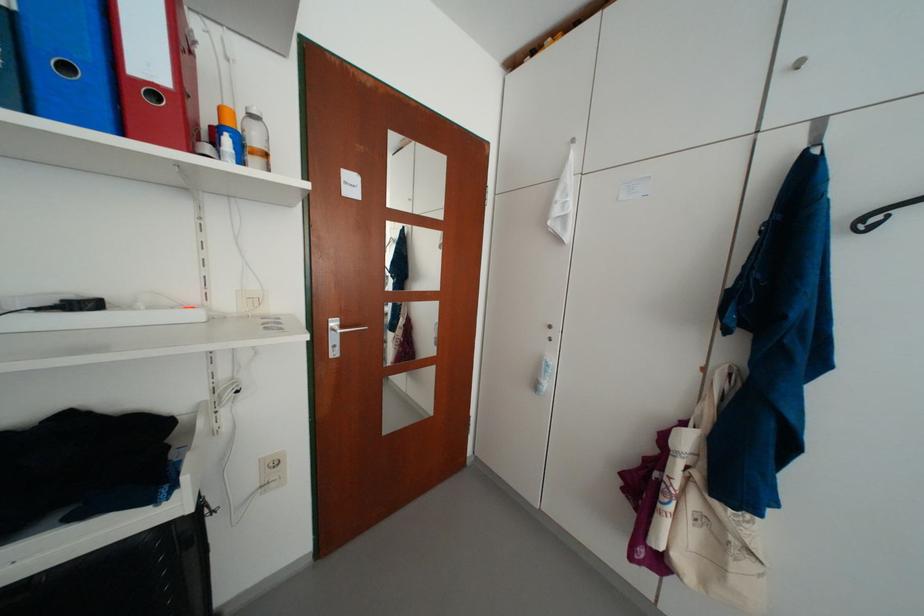
This screenshot has height=616, width=924. Identify the location of silver door handle. (347, 329).